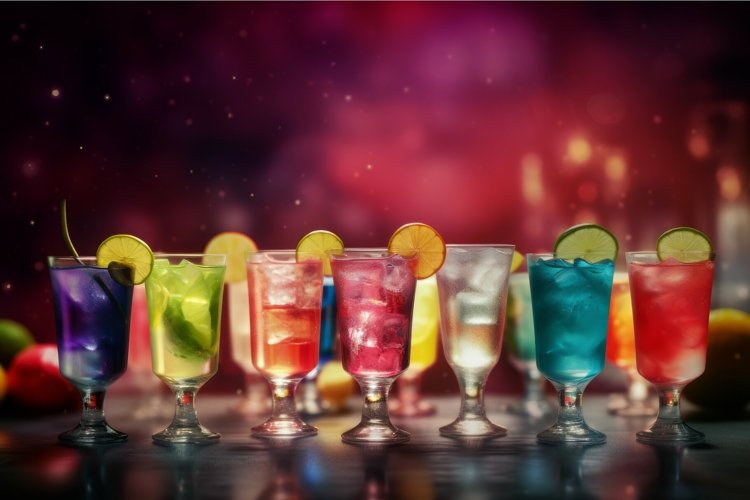
This screenshot has width=750, height=500. I want to click on counter, so click(x=432, y=476).